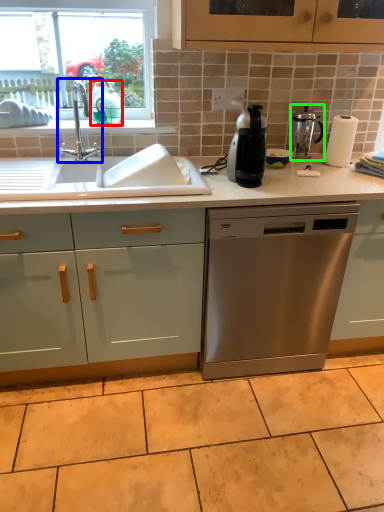
Question: Estimate the real-world distances between objects in this image. Which object is closer to teal (highlighted by a red box), tap (highlighted by a blue box) or kitchen appliance (highlighted by a green box)?

Choices:
 (A) tap
 (B) kitchen appliance

Answer: (A)